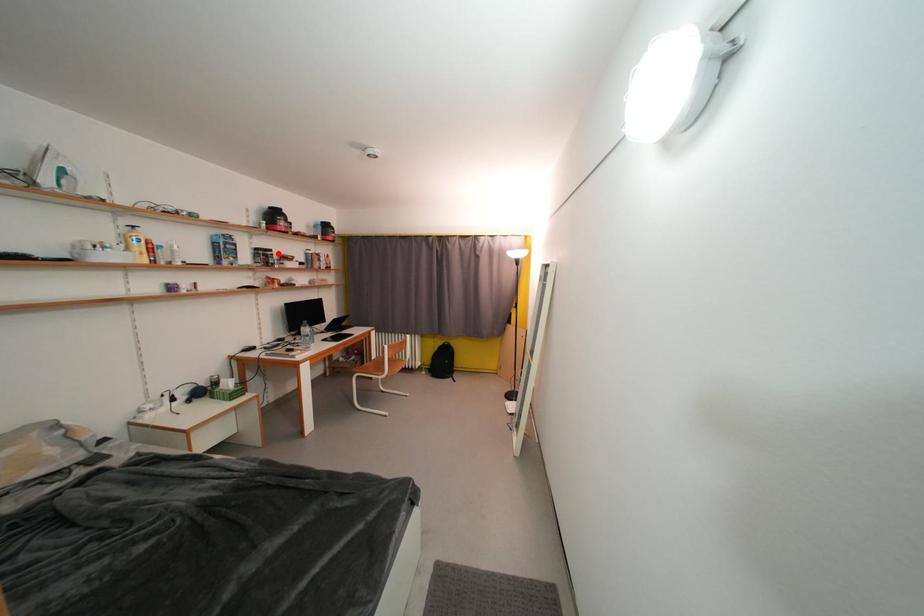
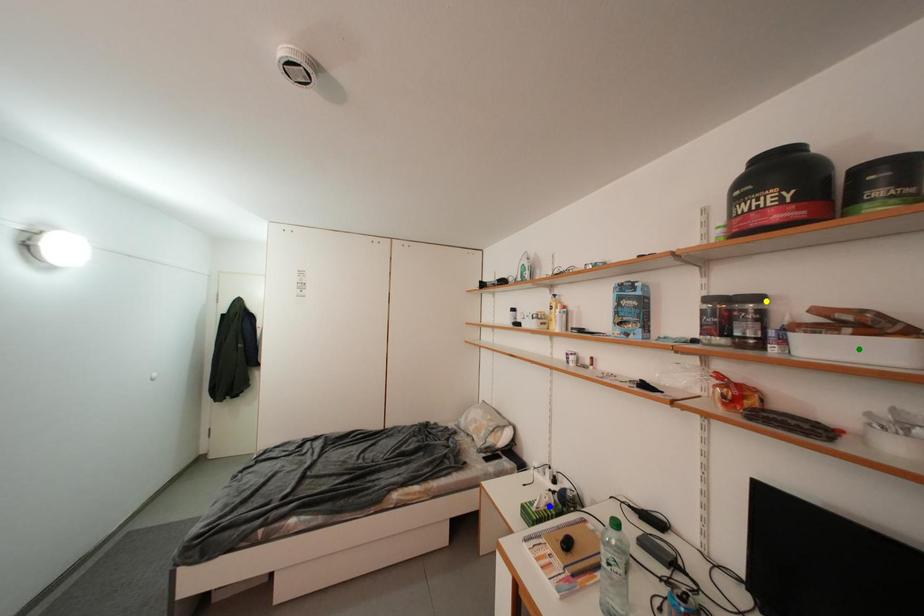
Question: I am providing you with two images of the same scene from different viewpoints. A red point is marked on the first image. You are given multiple points on the second image. Which mark in image 2 goes with the point in image 1?

Choices:
 (A) blue point
 (B) green point
 (C) yellow point

Answer: (C)